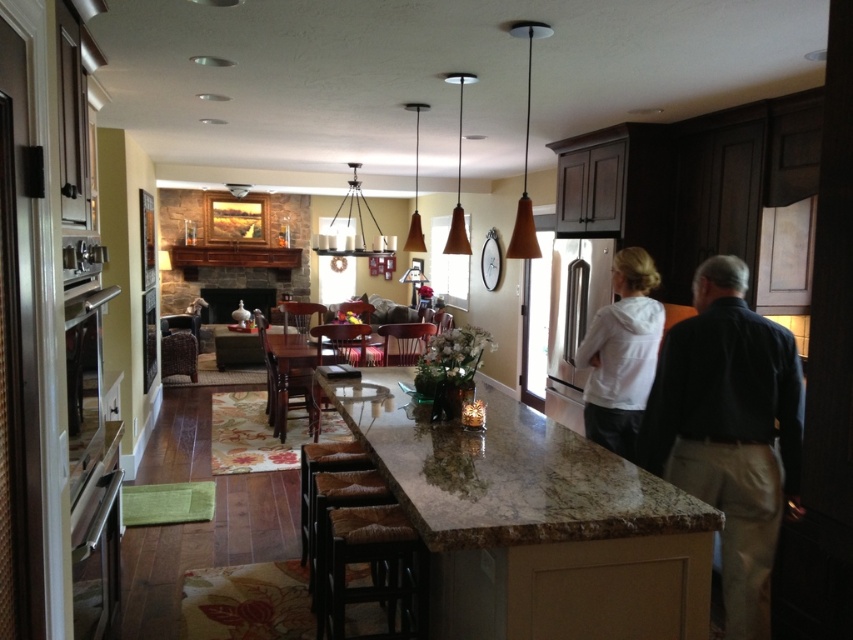
Question: Among these objects, which one is farthest from the camera?

Choices:
 (A) marble countertop at center
 (B) dark blue shirt at center
 (C) white matte hoodie at center

Answer: (C)

Question: Estimate the real-world distances between objects in this image. Which object is farther from the dark blue shirt at center?

Choices:
 (A) white matte hoodie at center
 (B) marble countertop at center

Answer: (B)

Question: Does marble countertop at center have a lesser width compared to dark blue shirt at center?

Choices:
 (A) yes
 (B) no

Answer: (B)

Question: Based on their relative distances, which object is nearer to the marble countertop at center?

Choices:
 (A) dark blue shirt at center
 (B) white matte hoodie at center

Answer: (A)

Question: Can you confirm if marble countertop at center is positioned to the right of white matte hoodie at center?

Choices:
 (A) yes
 (B) no

Answer: (B)

Question: Does marble countertop at center appear over dark blue shirt at center?

Choices:
 (A) yes
 (B) no

Answer: (A)